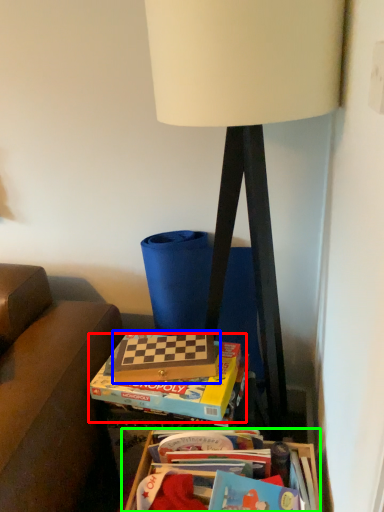
Question: Which object is the farthest from paperback book (highlighted by a red box)? Choose among these: paperback book (highlighted by a blue box) or table (highlighted by a green box).

Choices:
 (A) paperback book
 (B) table

Answer: (B)